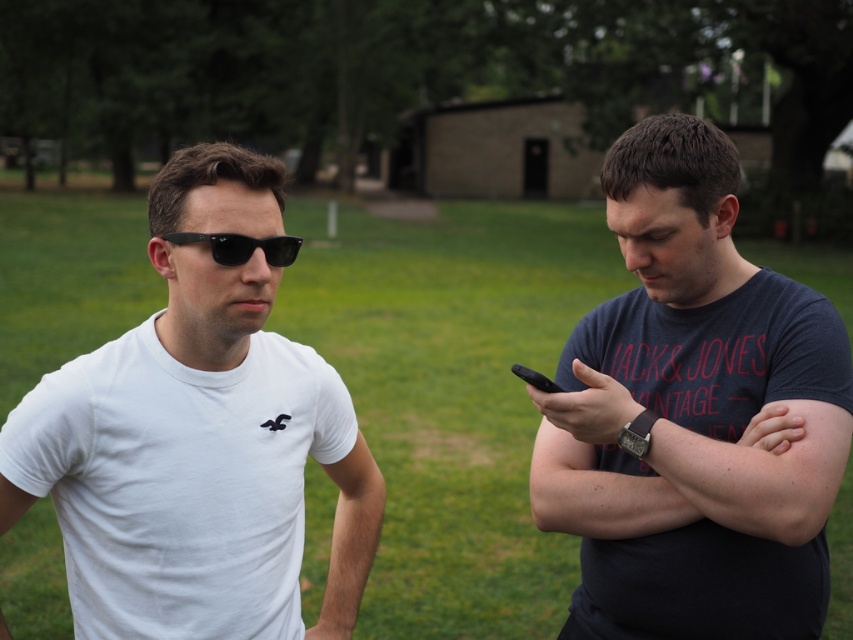
Does white smooth t-shirt at left have a smaller size compared to black matte smartphone at right?

No, white smooth t-shirt at left is not smaller than black matte smartphone at right.

Does white smooth t-shirt at left appear under black matte smartphone at right?

Correct, white smooth t-shirt at left is located below black matte smartphone at right.

Who is more distant from viewer, (331, 570) or (554, 390)?

The point (331, 570) is behind.

This screenshot has height=640, width=853. Find the location of `white smooth t-shirt at left`. white smooth t-shirt at left is located at coordinates (347, 528).

Which is more to the left, dark blue fabric at right or black matte smartphone at right?

Positioned to the left is black matte smartphone at right.

The height and width of the screenshot is (640, 853). Describe the element at coordinates (679, 468) in the screenshot. I see `dark blue fabric at right` at that location.

Who is more forward, (599, 506) or (523, 369)?

Positioned in front is point (523, 369).

The image size is (853, 640). Identify the location of dark blue fabric at right. (679, 468).

Between dark blue fabric at right and white smooth t-shirt at left, which one is positioned lower?

white smooth t-shirt at left

Which is more to the left, dark blue fabric at right or white smooth t-shirt at left?

Positioned to the left is white smooth t-shirt at left.

Where is `dark blue fabric at right`? dark blue fabric at right is located at coordinates (679, 468).